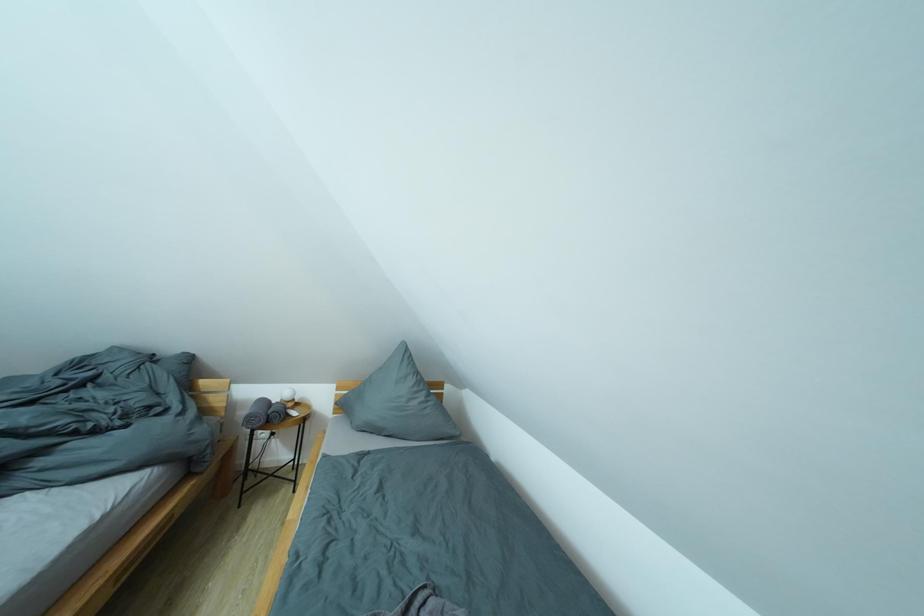
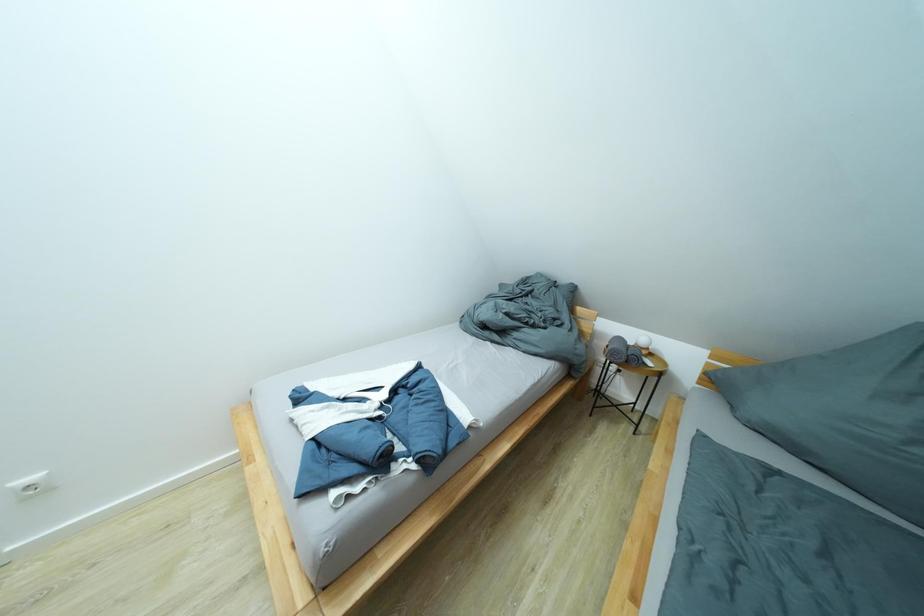
Question: The camera is either moving clockwise (left) or counter-clockwise (right) around the object. The first image is from the beginning of the video and the second image is from the end. Is the camera moving left or right when shooting the video?

Choices:
 (A) Left
 (B) Right

Answer: (B)